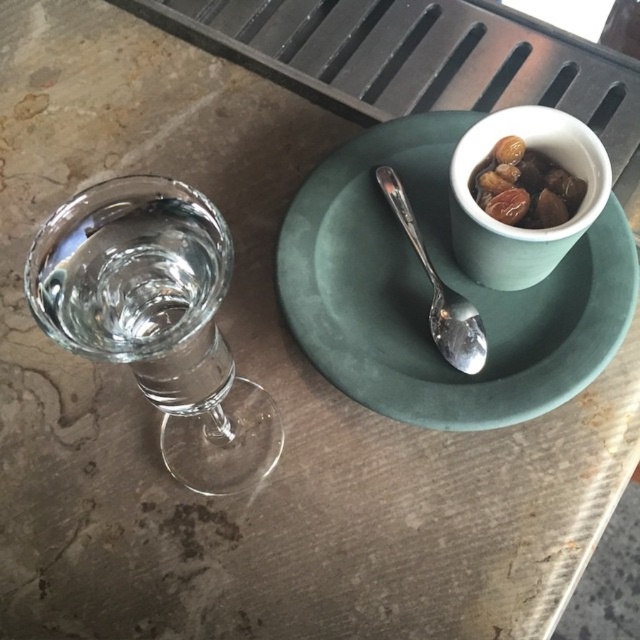
Is point (70, 230) positioned after point (451, 168)?

No, (70, 230) is in front of (451, 168).

Where is `transparent glass at left`? transparent glass at left is located at coordinates (156, 320).

Can you confirm if green matte plate at center is positioned to the left of satin silver spoon at center?

Incorrect, green matte plate at center is not on the left side of satin silver spoon at center.

Is green matte plate at center positioned before satin silver spoon at center?

That is True.

Who is more forward, [428,129] or [381,182]?

Point [381,182] is more forward.

You are a GUI agent. You are given a task and a screenshot of the screen. Output one action in this format:
    pyautogui.click(x=<x>, y=<y>)
    Task: Click on the green matte plate at center
    The image size is (640, 640).
    Given the screenshot: What is the action you would take?
    pyautogui.click(x=429, y=291)

Can you confirm if transparent glass at left is smaller than satin silver spoon at center?

No.

Can you confirm if transparent glass at left is taller than satin silver spoon at center?

Indeed, transparent glass at left has a greater height compared to satin silver spoon at center.

Is point (211, 305) closer to viewer compared to point (460, 362)?

Yes, point (211, 305) is closer to viewer.

This screenshot has height=640, width=640. In order to click on transparent glass at left in this screenshot , I will do `click(156, 320)`.